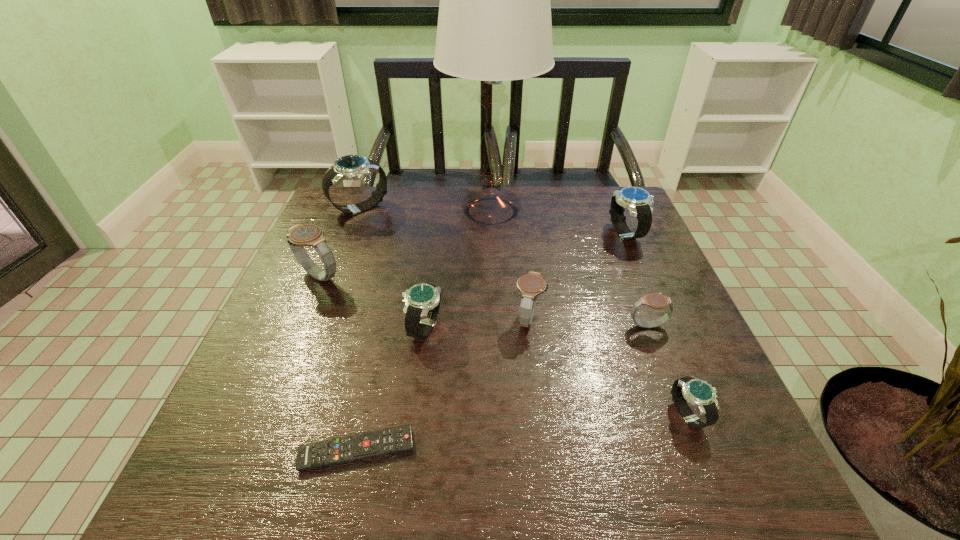
Where is `silver watch that is the third nearest to the remote control`? The height and width of the screenshot is (540, 960). silver watch that is the third nearest to the remote control is located at coordinates (350, 167).

What are the coordinates of `gray watch that stands as the third closest to the remote control` in the screenshot? It's located at (655, 300).

In order to click on the third closest gray watch to the third smallest silver watch in this screenshot , I will do `click(311, 235)`.

The height and width of the screenshot is (540, 960). In order to click on free point that satisfies the following two spatial constraints: 1. on the front side of the nearest silver watch; 2. on the left side of the fourth watch from left to right in this screenshot , I will do `click(540, 415)`.

The height and width of the screenshot is (540, 960). Identify the location of blank area in the image that satisfies the following two spatial constraints: 1. on the front-facing side of the fourth watch from left to right; 2. on the right side of the table lamp. (494, 319).

Where is `free location that satisfies the following two spatial constraints: 1. on the front-facing side of the tallest object; 2. on the left side of the rightmost gray watch`? free location that satisfies the following two spatial constraints: 1. on the front-facing side of the tallest object; 2. on the left side of the rightmost gray watch is located at coordinates (495, 325).

This screenshot has height=540, width=960. What are the coordinates of `vacant space that satisfies the following two spatial constraints: 1. on the back side of the smallest gray watch; 2. on the front-facing side of the table lamp` in the screenshot? It's located at (603, 211).

Where is `vacant space that satisfies the following two spatial constraints: 1. on the front side of the nearest silver watch; 2. on the left side of the rightmost gray watch`? The width and height of the screenshot is (960, 540). vacant space that satisfies the following two spatial constraints: 1. on the front side of the nearest silver watch; 2. on the left side of the rightmost gray watch is located at coordinates (682, 415).

In order to click on vacant space that satisfies the following two spatial constraints: 1. on the front side of the leftmost silver watch; 2. on the right side of the nearest watch in this screenshot , I will do `click(282, 415)`.